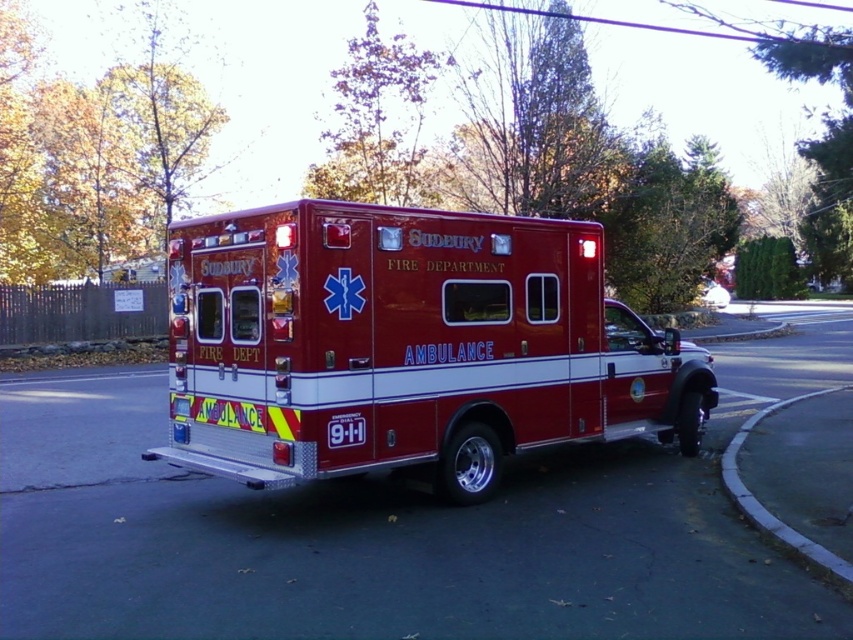
You are a delivery driver who needs to unload a package from your truck parked behind the shiny red ambulance at center. The gray concrete curb at lower right is where you need to place the package. Considering the distance between them, can your truck, which is 4.5 meters long, safely maneuver around the ambulance to reach the curb?

The distance between the shiny red ambulance at center and the gray concrete curb at lower right is 5.05 meters. Since your truck is 4.5 meters long, it can safely maneuver around the ambulance to reach the curb as there is enough space between them.

You are a pedestrian standing on the sidewalk and see the shiny red ambulance at center and the gray concrete curb at lower right. Which object is closer to you?

The shiny red ambulance at center is closer to you than the gray concrete curb at lower right because it is positioned further to the viewer.

You are a pedestrian standing at the point closest to the ambulance. Which point, point (462, 278) or point (729, 480), is closer to you?

Point (462, 278) is in front of point (729, 480), so the pedestrian is closer to point (462, 278).